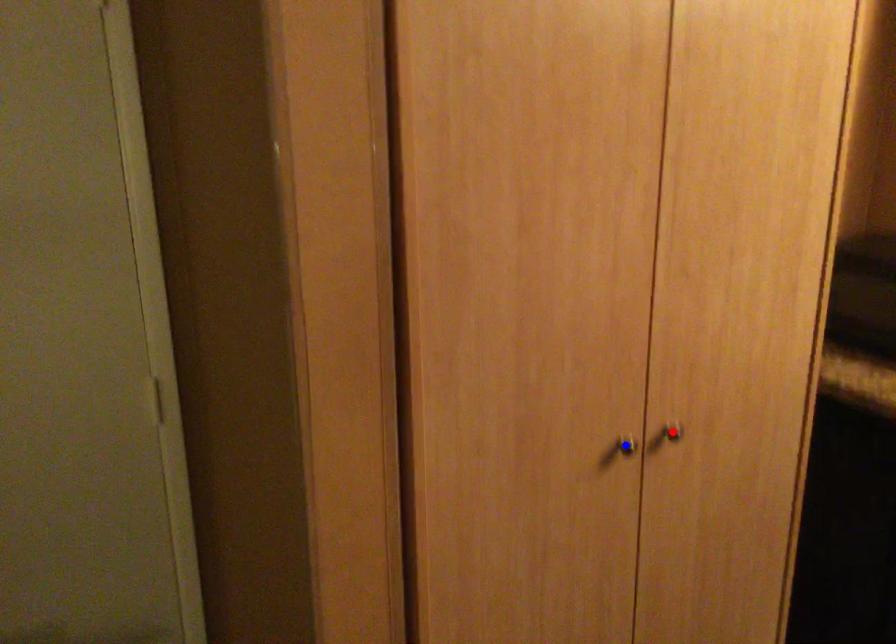
Question: Which of the two points in the image is closer to the camera?

Choices:
 (A) Blue point is closer.
 (B) Red point is closer.

Answer: (A)